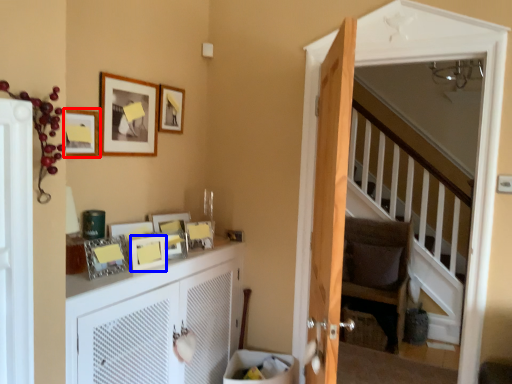
Question: Which object appears closest to the camera in this image, picture frame (highlighted by a red box) or picture frame (highlighted by a blue box)?

Choices:
 (A) picture frame
 (B) picture frame

Answer: (A)